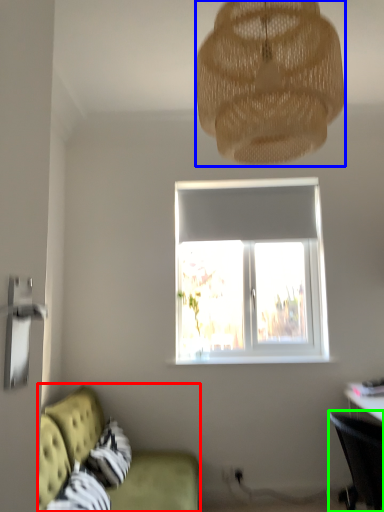
Question: Which object is positioned closest to studio couch (highlighted by a red box)? Select from lamp (highlighted by a blue box) and chair (highlighted by a green box).

Choices:
 (A) lamp
 (B) chair

Answer: (B)